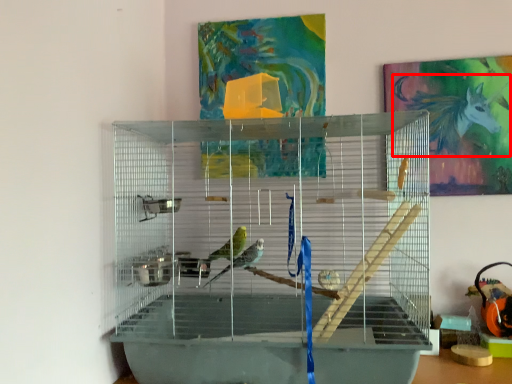
Question: From the image's perspective, where is animal (annotated by the red box) located relative to bird cage?

Choices:
 (A) above
 (B) below

Answer: (A)